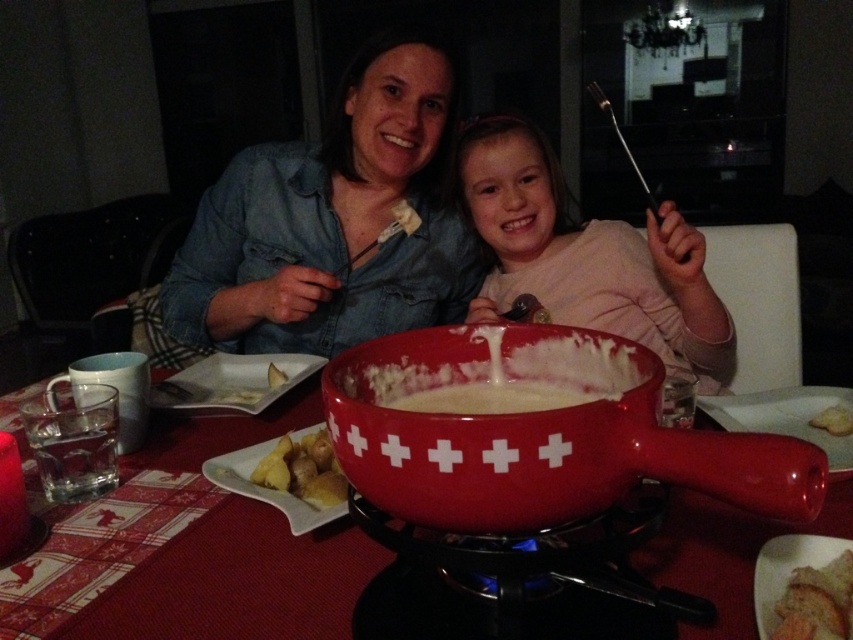
You are a guest at the dinner table and want to place your napkin on the largest object on the table. Which object should you choose between the matte ceramic fondue pot at center and the slightly toasted bread at lower right?

The matte ceramic fondue pot at center has a larger width than the slightly toasted bread at lower right, so you should place your napkin on the matte ceramic fondue pot at center.

You are a guest at a dinner party and want to reach for the slightly toasted bread at lower right without touching the hot matte ceramic fondue pot at center. Which direction should you move your hand to safely grab it?

The matte ceramic fondue pot at center is to the left of the slightly toasted bread at lower right, so you should move your hand to the right to safely grab the slightly toasted bread at lower right without touching the pot.

You are a guest at this dinner and want to place your phone on the table without covering any food items. The phone is 12 cm long. Can you put it on the matte pink sweater at center or the slightly toasted bread at lower right?

The matte pink sweater at center might be wider than slightly toasted bread at lower right, so placing the phone on the matte pink sweater at center would be safer since it has more space. Avoid placing it on the slightly toasted bread at lower right as it might not fit or could cover the bread.